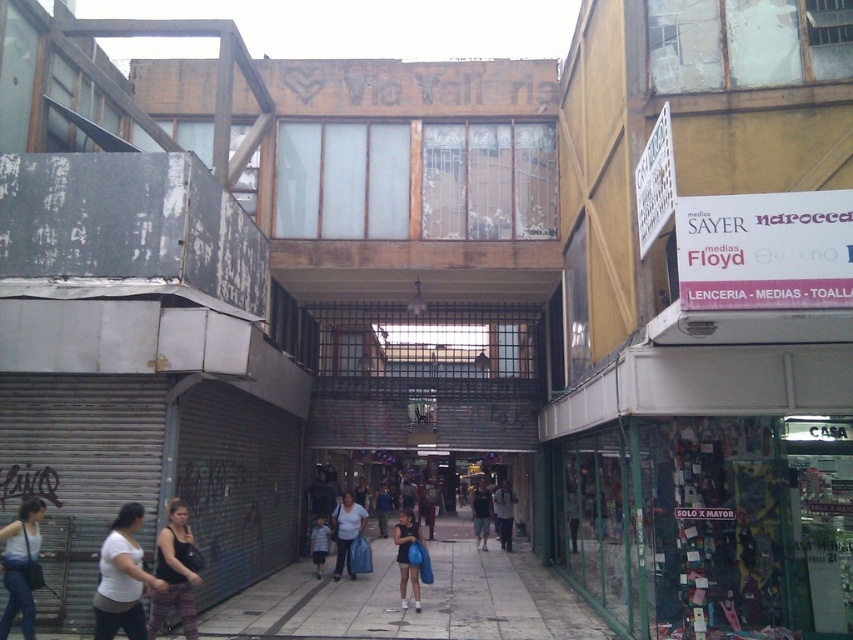
You are a photographer trying to capture a clear shot of the light blue jeans at center without the matte black tank top at lower left blocking it. Based on the scene, what adjustment should you make to your camera position?

The matte black tank top at lower left is in front of the light blue jeans at center. To avoid blocking, move your camera position backward to create more distance between the two subjects.

You are a delivery person carrying a package that requires a 6 meter minimum distance between the delivery point and the recipient. You see a matte blue bag at center and light blue jeans at center in the alleyway. Can you deliver the package between them?

The matte blue bag at center is 6.54 meters from the light blue jeans at center. Since the required minimum distance is 6 meters, the delivery can be made between them as the distance is sufficient.

You are a photographer standing at the center of the alleyway. You want to take a photo of the matte black tank top at lower left. Which direction should you move to get a clear shot of it?

Since the matte black tank top at lower left is located at point 0.897 on the x axis and 0.206 on the y axis, you should move to your right to align with the x coordinate and slightly forward to reach the y coordinate for a clear shot.